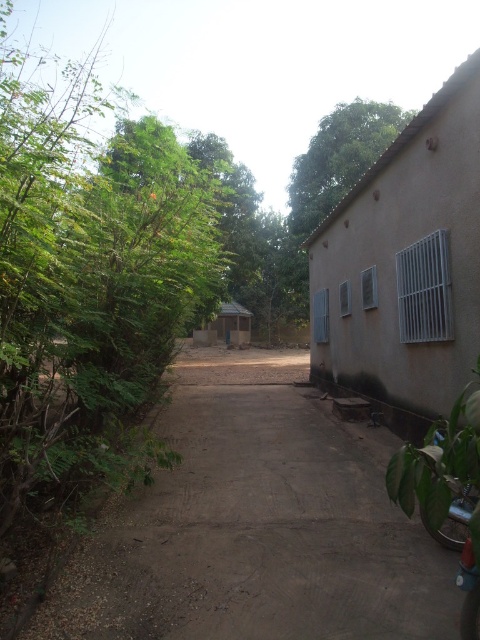
Question: Is dirt path at center above green leafy bush at left?

Choices:
 (A) no
 (B) yes

Answer: (A)

Question: Can you confirm if green leafy bush at left is bigger than green leafy tree at upper center?

Choices:
 (A) yes
 (B) no

Answer: (A)

Question: Which of the following is the closest to the observer?

Choices:
 (A) green leafy bush at left
 (B) dirt path at center

Answer: (A)

Question: Can you confirm if dirt path at center is positioned below green leafy bush at left?

Choices:
 (A) no
 (B) yes

Answer: (B)

Question: Which object appears closest to the camera in this image?

Choices:
 (A) dirt path at center
 (B) green leafy bush at left
 (C) green leafy tree at upper center

Answer: (B)

Question: Which point is closer to the camera taking this photo?

Choices:
 (A) (204, 556)
 (B) (321, 138)

Answer: (A)